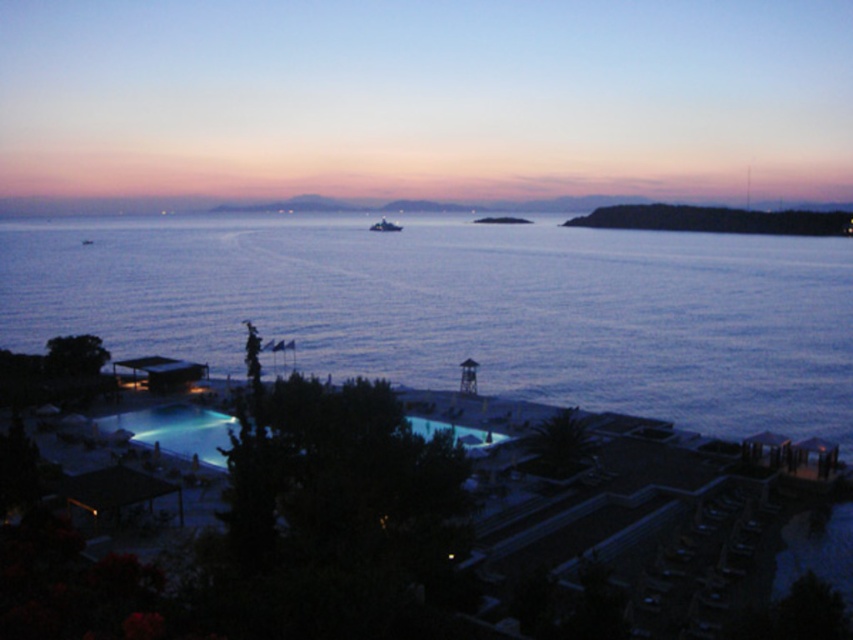
Question: Based on their relative distances, which object is nearer to the metallic blue boat at center?

Choices:
 (A) illuminated glass pool at center
 (B) matte black building at lower left
 (C) blue water at center

Answer: (C)

Question: Does matte black building at lower left have a smaller size compared to metallic blue boat at center?

Choices:
 (A) no
 (B) yes

Answer: (B)

Question: Does illuminated glass pool at center appear over metallic blue boat at center?

Choices:
 (A) no
 (B) yes

Answer: (A)

Question: Can you confirm if illuminated glass pool at center is bigger than matte black building at lower left?

Choices:
 (A) no
 (B) yes

Answer: (B)

Question: Which point is closer to the camera?

Choices:
 (A) (387, 227)
 (B) (405, 257)
 (C) (138, 378)

Answer: (C)

Question: Which object is positioned farthest from the metallic blue boat at center?

Choices:
 (A) matte black building at lower left
 (B) blue water at center

Answer: (A)